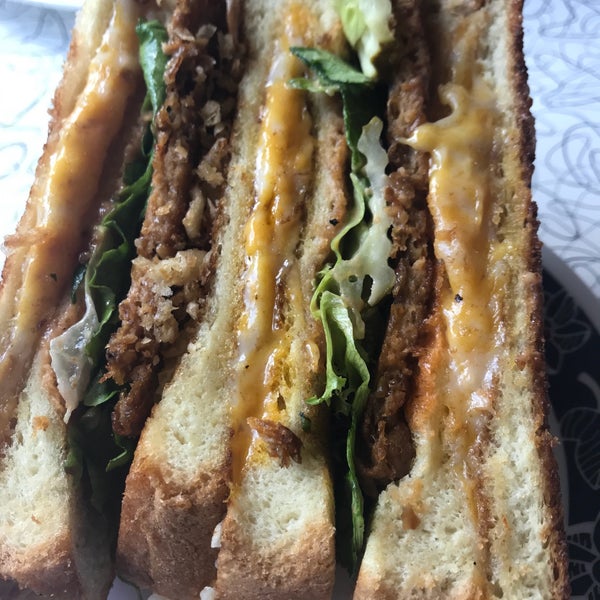
In order to click on plate in this screenshot , I will do `click(29, 111)`.